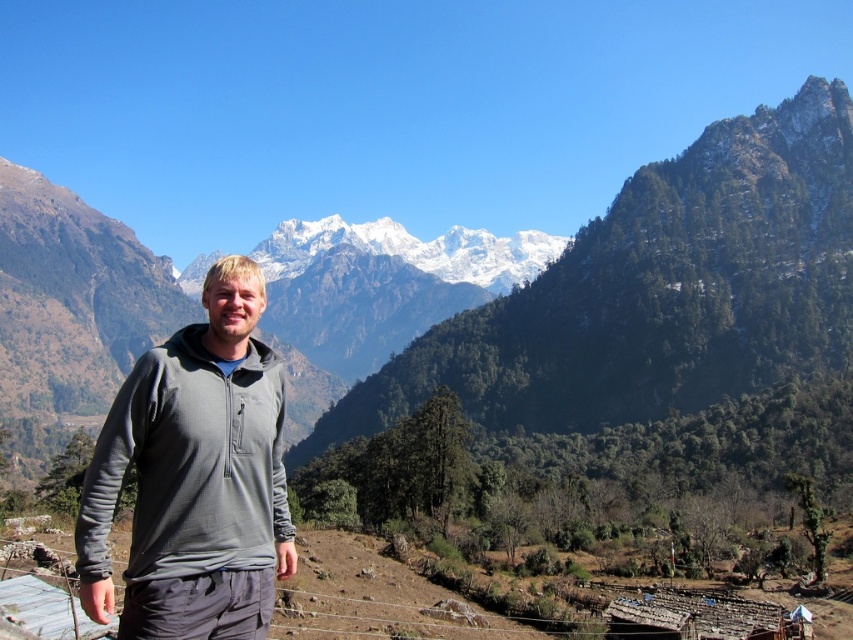
You are planning to take a photo of the snowy granite mountain range at upper center and the gray fleece jacket at center. Which object should you focus on first if you want to capture both in a single frame without moving the camera? Explain your reasoning based on their sizes in the image.

The snowy granite mountain range at upper center should be focused on first because its width surpasses that of the gray fleece jacket at center, making it the larger object in the frame. By prioritizing the wider mountain range, you ensure it occupies the necessary space while still allowing the jacket to fit within the same frame.

You are a hiker planning to take a photo of the snowy granite mountain range at upper center while wearing the gray fleece jacket at center. If you want to ensure both the mountain range and your jacket are clearly visible in the photo, what should you consider about their distance?

The snowy granite mountain range at upper center and gray fleece jacket at center are 336.23 meters apart from each other. To ensure both are clearly visible, you need to use a camera with a sufficient focal length to capture both the distant mountain range and the jacket in focus at that distance.

You are standing at the point with coordinates point (227, 632) and want to walk towards the point with coordinates point (381, 396). Which direction should you move relative to your current position?

You should move towards the point (381, 396) by going to the left and upwards since point (381, 396) is behind point (227, 632).